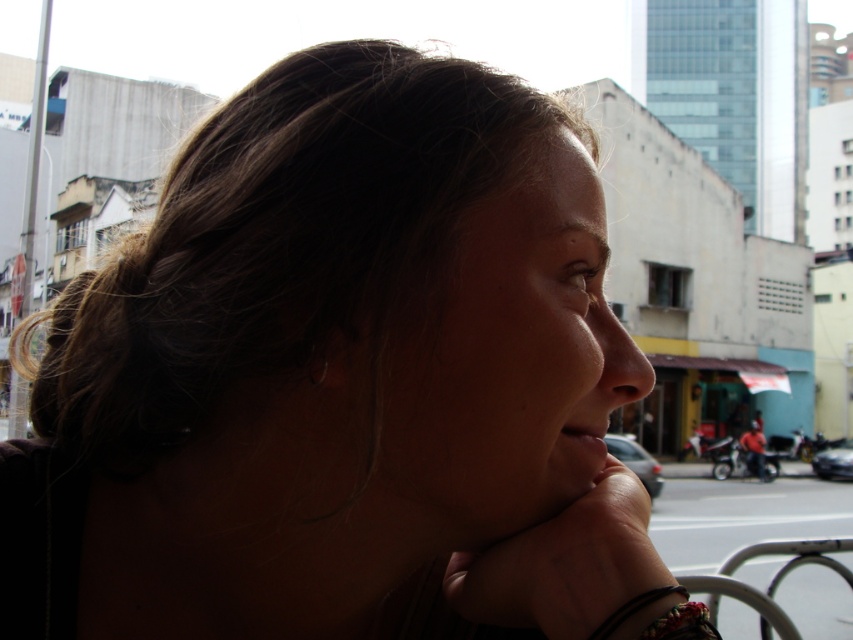
You are a photographer trying to capture a close shot of the shiny metallic bracelet at lower right and the silver metallic earring at upper left. Which object is located more to the right side of the image?

The shiny metallic bracelet at lower right is positioned on the right side of the silver metallic earring at upper left, so the bracelet is more to the right.

You are a photographer trying to capture a detailed shot of two specific points in the scene. The first point is at coordinates point (579, 454) and the second is at point (320, 381). Since you want to focus on the one closer to the camera, which point should you adjust your lens to focus on?

Point (320, 381) is closer to the camera than point (579, 454), so you should focus your lens on point (320, 381).